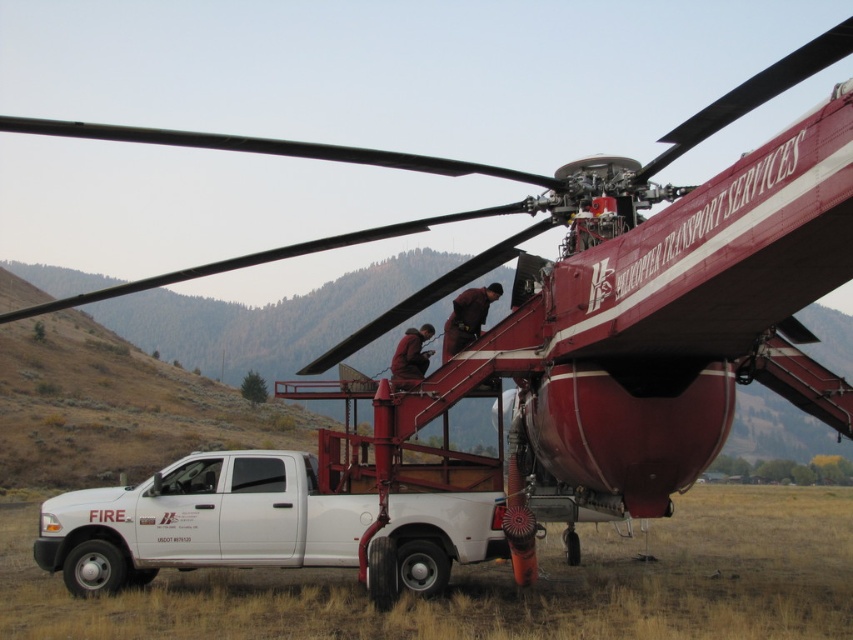
You are standing at the point labeled point [407,374] and want to walk to the helicopter. Which direction should you go relative to point [300,499]?

You should walk towards point [300,499] because it is in front of point [407,374], so moving toward it will lead you closer to the helicopter.

You are a firefighter assessing the scene. You see the white matte truck at lower left and the dark brown leather jacket at center. Which object is wider?

The white matte truck at lower left is wider than the dark brown leather jacket at center.

You are standing at the origin point of the coordinate system where the helicopter is at the center. The white matte truck at lower left is located at point (201, 522). Can you determine the direction of the white matte truck at lower left relative to the helicopter?

The white matte truck at lower left is located at point (201, 522) relative to the helicopter, which means it is positioned to the right and above the helicopter.